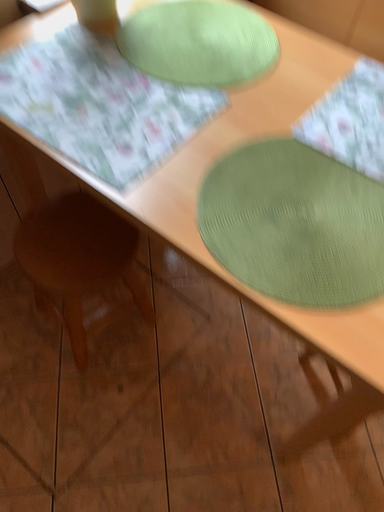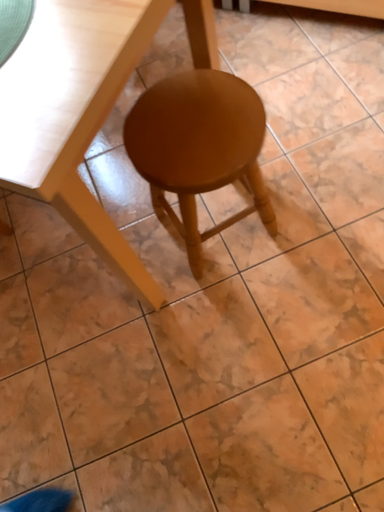
Question: How did the camera likely rotate when shooting the video?

Choices:
 (A) rotated upward
 (B) rotated downward

Answer: (B)